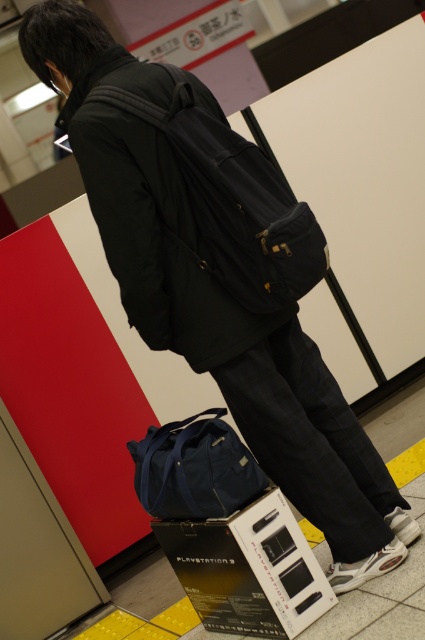
You are a delivery person who needs to stack the black fabric backpack at center and the matte blue duffel bag at lower center onto a delivery cart. Which item should you place on top to ensure stability?

The matte blue duffel bag at lower center should be placed on top of the black fabric backpack at center since the backpack is much taller and can provide a stable base.

You are a security guard at the station and notice the black fabric backpack at center and the matte blue duffel bag at lower center. Which item is positioned higher relative to the other?

The black fabric backpack at center is located above the matte blue duffel bag at lower center.